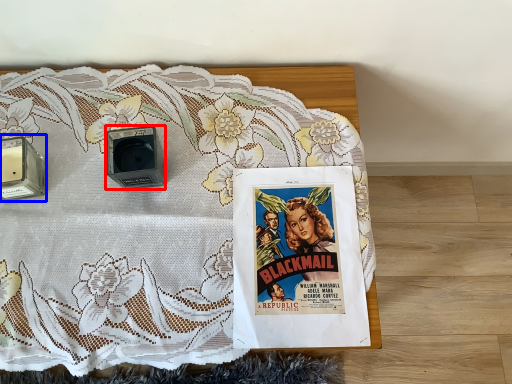
Question: Which point is further to the camera, speaker (highlighted by a red box) or speaker (highlighted by a blue box)?

Choices:
 (A) speaker
 (B) speaker

Answer: (B)